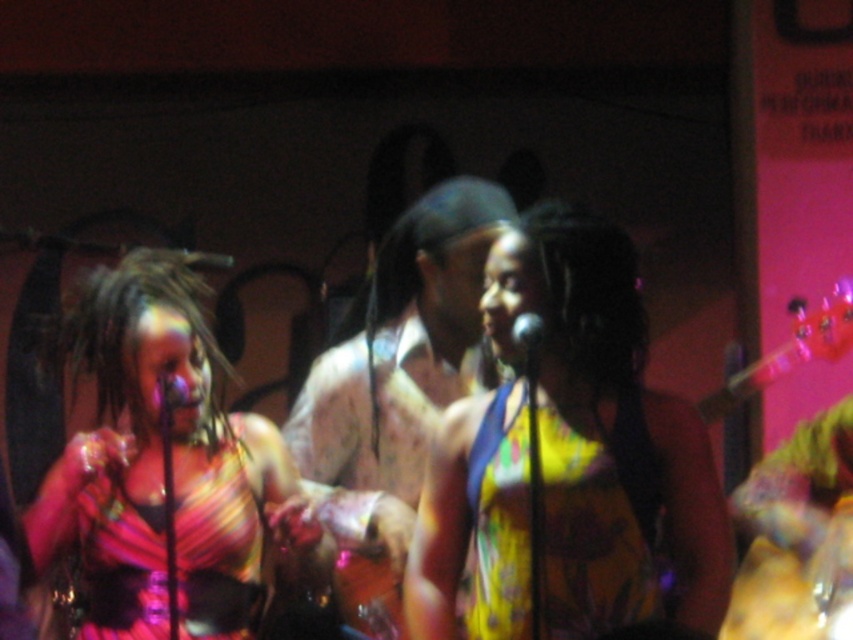
You are a photographer in a dimly lit venue and need to capture a clear shot of both the patterned fabric shirt at center and the black matte microphone at center. Given that the shirt is larger than the microphone, which object should you focus on first to ensure both are in focus?

The patterned fabric shirt at center is larger than the black matte microphone at center, so focusing on the larger shirt first will help ensure the microphone also stays in focus since it occupies less space in the frame.

You are a photographer at the concert venue and want to take a photo of the shiny metallic dress at left. To ensure the dress is well lit, you need to position a spotlight directly above it. Given the stage coordinates system where the bottom left corner is the origin point, can you determine if the spotlight placed at coordinate point (164, 468) will be directly above the shiny metallic dress at left?

Yes, the point (164, 468) marks the location of the shiny metallic dress at left, so placing the spotlight at that coordinate will be directly above it.

You are a photographer at the back of the stage. You need to capture a clear photo of both the yellow floral dress at center and the patterned fabric shirt at center. Which one should you zoom in on first to ensure it fits in the frame?

The yellow floral dress at center is smaller than the patterned fabric shirt at center, so you should zoom in on the patterned fabric shirt at center first to ensure it fits in the frame.